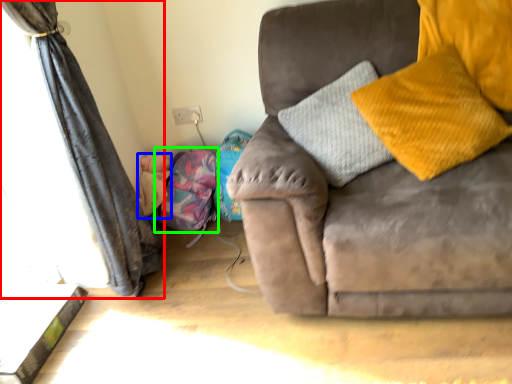
Question: Which object is the farthest from curtain (highlighted by a red box)? Choose among these: baby (highlighted by a blue box) or bean bag chair (highlighted by a green box).

Choices:
 (A) baby
 (B) bean bag chair

Answer: (A)